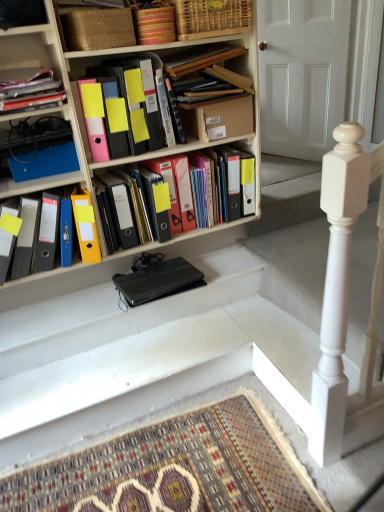
Where is `empty space that is ontop of matte plastic folders at left, the 1th book in the bottom-to-top sequence (from a real-world perspective)`? Image resolution: width=384 pixels, height=512 pixels. empty space that is ontop of matte plastic folders at left, the 1th book in the bottom-to-top sequence (from a real-world perspective) is located at coordinates (36, 194).